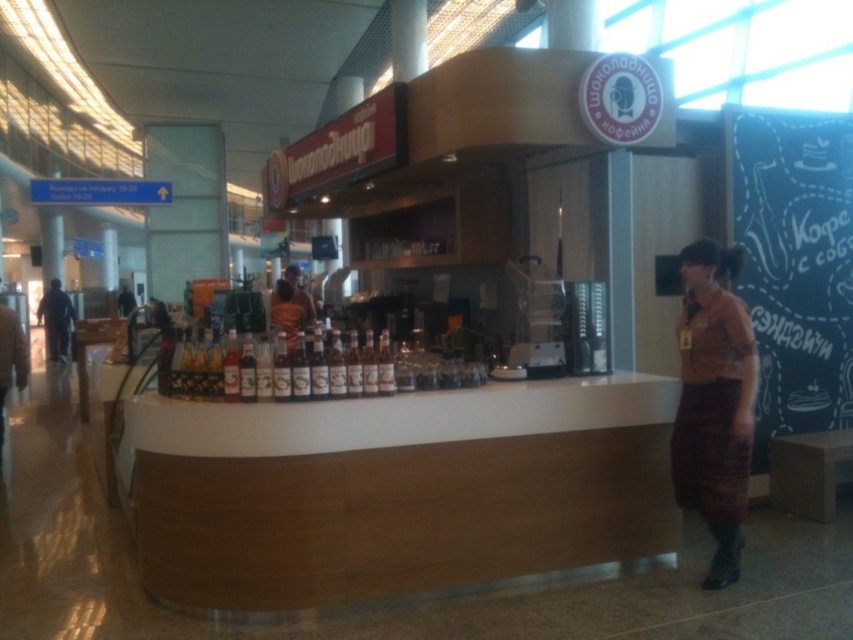
Question: Can you confirm if wooden table at center is thinner than matte brown shirt at center?

Choices:
 (A) yes
 (B) no

Answer: (A)

Question: Which object appears closest to the camera in this image?

Choices:
 (A) matte brown shirt at center
 (B) dark blue jeans at left
 (C) wooden table at center
 (D) translucent glass bottles at center

Answer: (D)

Question: Is translucent glass bottles at center to the right of matte brown shirt at center from the viewer's perspective?

Choices:
 (A) no
 (B) yes

Answer: (B)

Question: Which object appears farthest from the camera in this image?

Choices:
 (A) translucent glass bottles at center
 (B) wooden table at center
 (C) dark blue jeans at left
 (D) brown woven skirt at right

Answer: (C)

Question: Among these objects, which one is nearest to the camera?

Choices:
 (A) dark blue jeans at left
 (B) brown woven skirt at right
 (C) translucent glass bottles at center
 (D) wooden table at center

Answer: (C)

Question: Is brown woven skirt at right below matte brown shirt at center?

Choices:
 (A) yes
 (B) no

Answer: (A)